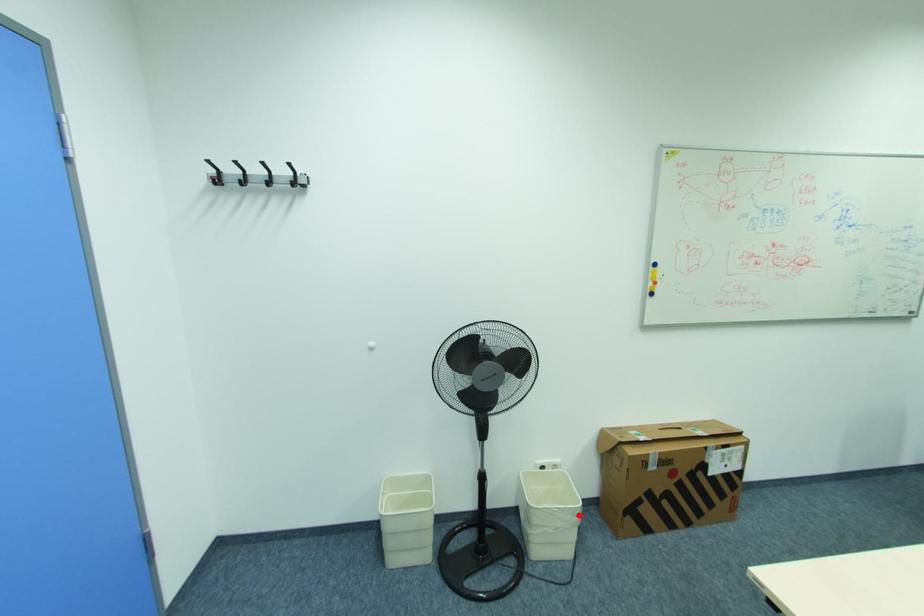
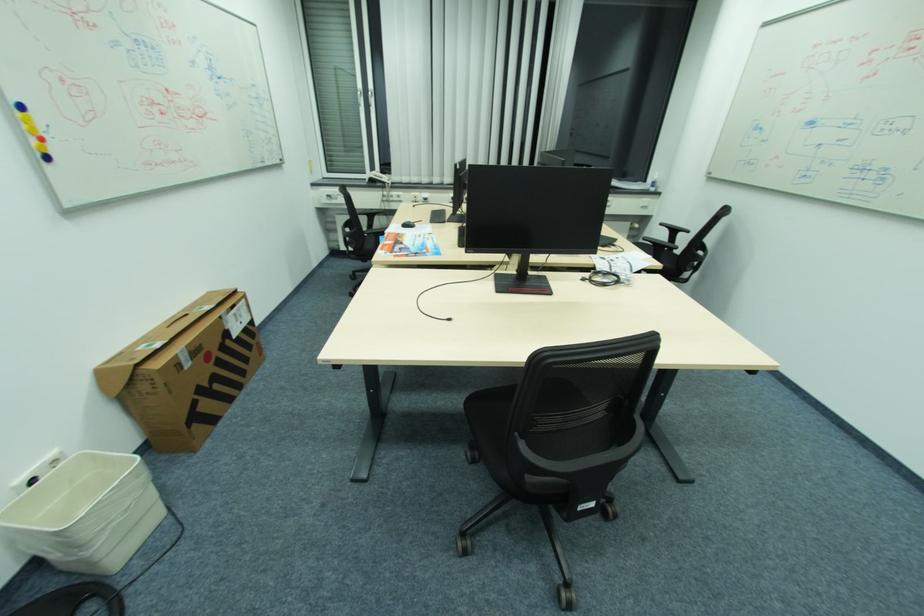
The point at the highlighted location is marked in the first image. Where is the corresponding point in the second image?

(143, 476)